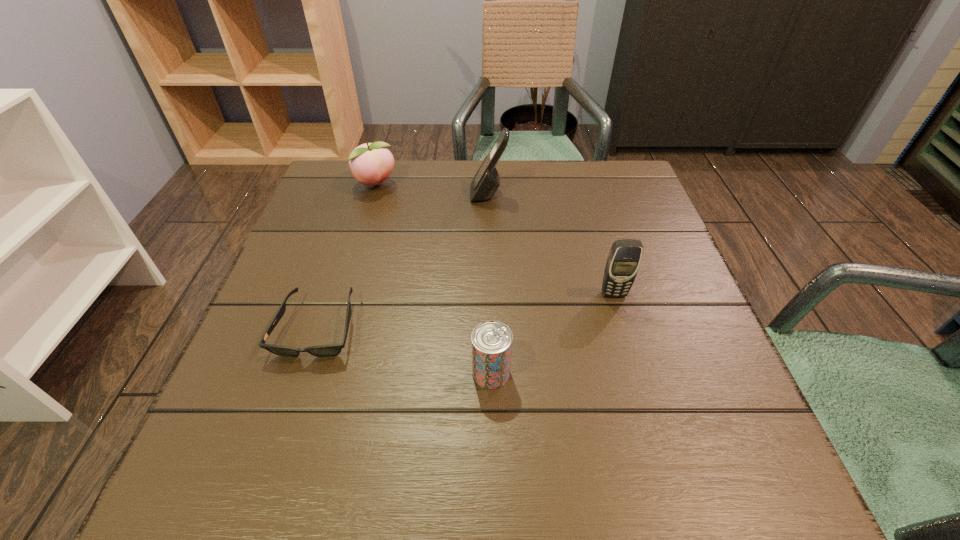
Locate an element on the screen. This screenshot has height=540, width=960. vacant space located 0.050m on the front face of the rightmost object is located at coordinates (621, 319).

At what (x,y) coordinates should I click in order to perform the action: click on vacant area situated 0.220m on the front of the peach. Please return your answer as a coordinate pair (x, y). Looking at the image, I should click on (354, 256).

This screenshot has height=540, width=960. I want to click on vacant space positioned 0.310m on the right of the beer can, so click(692, 373).

Locate an element on the screen. vacant position located 0.140m on the front-facing side of the sunglasses is located at coordinates (280, 442).

I want to click on cellular telephone that is at the far edge, so click(486, 181).

Find the location of a particular element. peach that is at the far edge is located at coordinates (371, 163).

At what (x,y) coordinates should I click in order to perform the action: click on peach that is at the left edge. Please return your answer as a coordinate pair (x, y). Looking at the image, I should click on (371, 163).

The height and width of the screenshot is (540, 960). In order to click on sunglasses located in the left edge section of the desktop in this screenshot , I will do `click(329, 350)`.

Locate an element on the screen. The image size is (960, 540). object that is at the right edge is located at coordinates tap(623, 261).

Where is `object situated at the far left corner`? This screenshot has width=960, height=540. object situated at the far left corner is located at coordinates (371, 163).